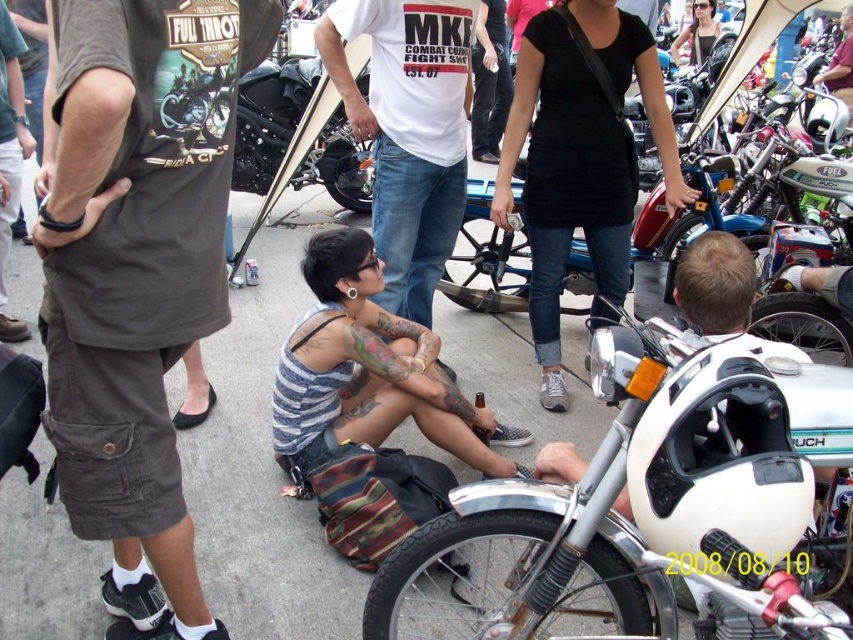
You are standing at the edge of the event area and want to take a photo of the shiny black motorcycle at center and the matte black tank top at center. Which object should you frame first in your camera to ensure both are in the shot?

You should frame the shiny black motorcycle at center first since it is to the left of the matte black tank top at center, allowing you to include both in the shot by positioning the motorcycle on the left side of the frame and the tank top on the right.

You are a photographer at the motorcycle event and want to take a photo of the shiny black motorcycle at center and the matte black tank top at center. Which object should you focus on first if you want to capture both in a single shot without zooming in or out?

You should focus on the shiny black motorcycle at center first because it is much taller than the matte black tank top at center, so adjusting the focus to accommodate its height would ensure both are in frame.

You are standing at the center of the scene. Which direction should you walk to reach the white matte motorcycle at lower right?

You should walk towards the lower right direction to reach the white matte motorcycle at lower right as it is located at point (637, 504).